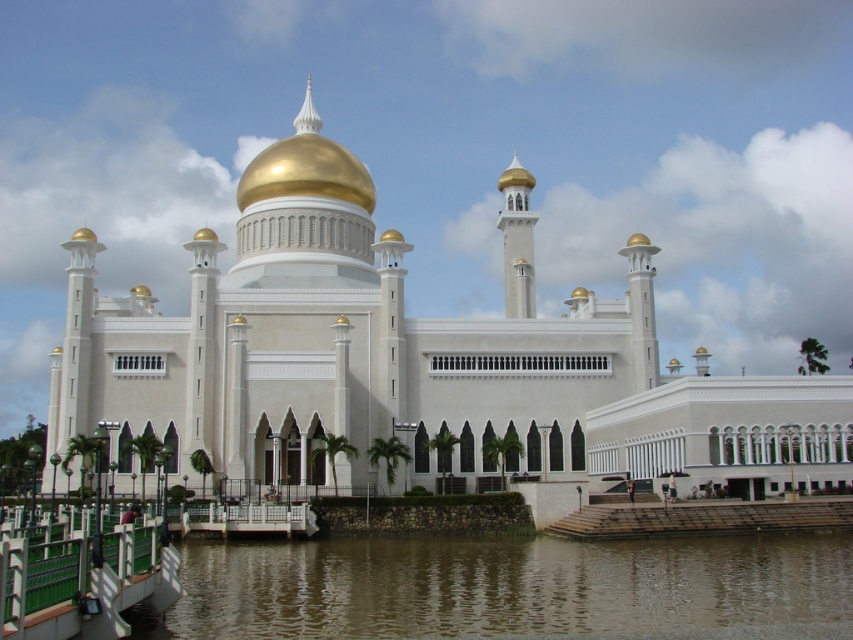
Question: Which point is closer to the camera taking this photo?

Choices:
 (A) (432, 625)
 (B) (831, 390)

Answer: (A)

Question: Can you confirm if white marble mosque at center is wider than brown murky water at lower center?

Choices:
 (A) yes
 (B) no

Answer: (A)

Question: Is white marble mosque at center below brown murky water at lower center?

Choices:
 (A) no
 (B) yes

Answer: (A)

Question: In this image, where is white marble mosque at center located relative to brown murky water at lower center?

Choices:
 (A) left
 (B) right

Answer: (B)

Question: Which point is closer to the camera?

Choices:
 (A) (486, 618)
 (B) (277, 369)

Answer: (A)